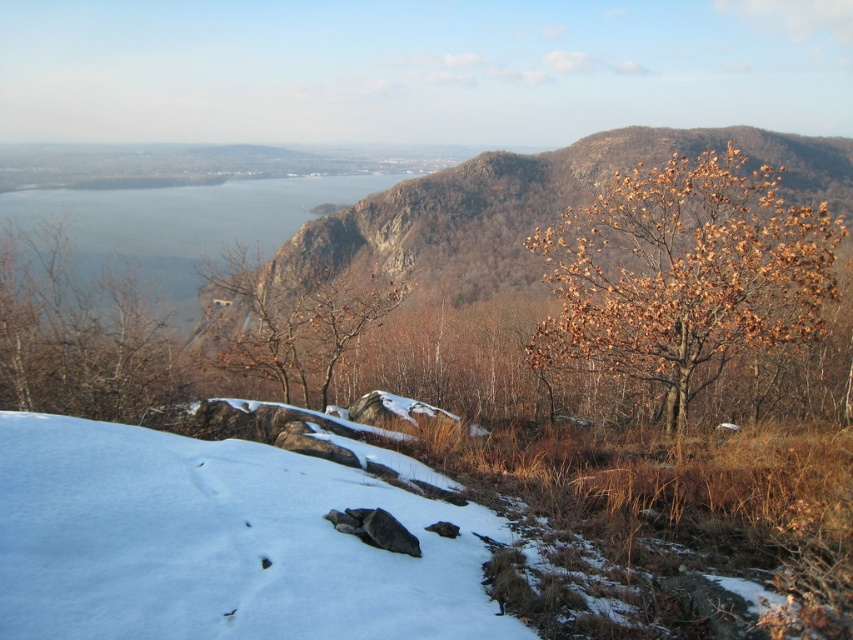
You are a photographer planning to capture a wide landscape shot of the brown leafy tree at right and the blue water at left. Your camera has a maximum focus range of 50 meters. Will both subjects be in focus at the same time?

The brown leafy tree at right and blue water at left are 50.18 meters apart from each other. Since the distance between them exceeds the camera maximum focus range of 50 meters, both subjects cannot be in focus simultaneously.